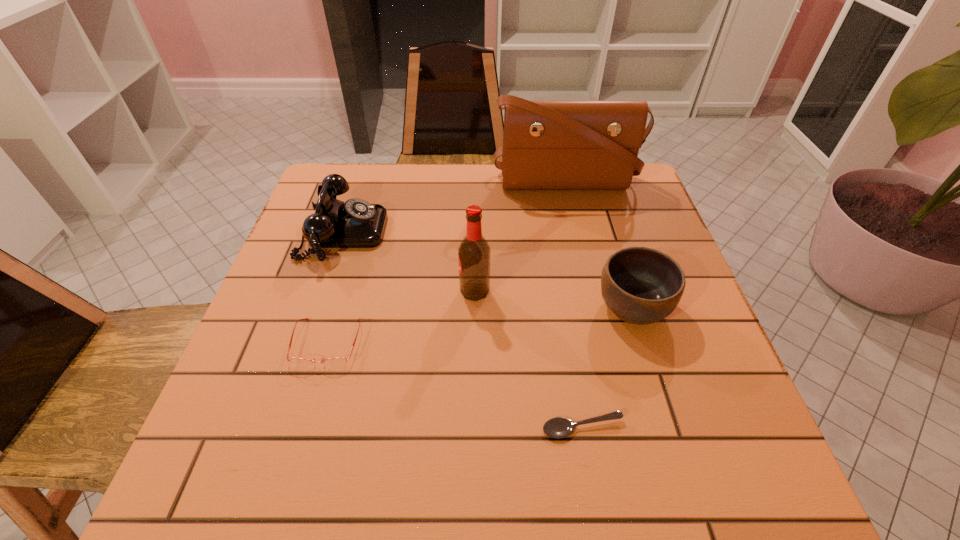
This screenshot has height=540, width=960. I want to click on the farthest object, so click(547, 144).

Image resolution: width=960 pixels, height=540 pixels. I want to click on satchel, so click(547, 144).

The width and height of the screenshot is (960, 540). I want to click on the third object from left to right, so click(474, 251).

Locate an element on the screen. beer bottle is located at coordinates (474, 251).

I want to click on the second farthest object, so click(x=356, y=223).

Image resolution: width=960 pixels, height=540 pixels. I want to click on bowl, so click(x=640, y=285).

Locate an element on the screen. Image resolution: width=960 pixels, height=540 pixels. spectacles is located at coordinates pyautogui.click(x=338, y=361).

Image resolution: width=960 pixels, height=540 pixels. I want to click on the shortest object, so click(558, 427).

Find the location of a particular element. Image resolution: width=960 pixels, height=540 pixels. the nearest object is located at coordinates (558, 427).

At what (x,y) coordinates should I click in order to perform the action: click on free space located on the front flap of the tallest object. Please return your answer as a coordinate pair (x, y). The width and height of the screenshot is (960, 540). Looking at the image, I should click on (586, 271).